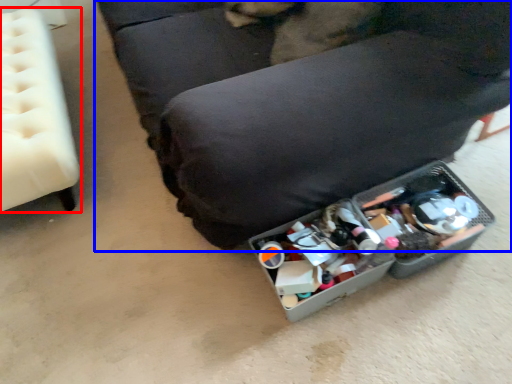
Question: Among these objects, which one is nearest to the camera, furniture (highlighted by a red box) or furniture (highlighted by a blue box)?

Choices:
 (A) furniture
 (B) furniture

Answer: (B)